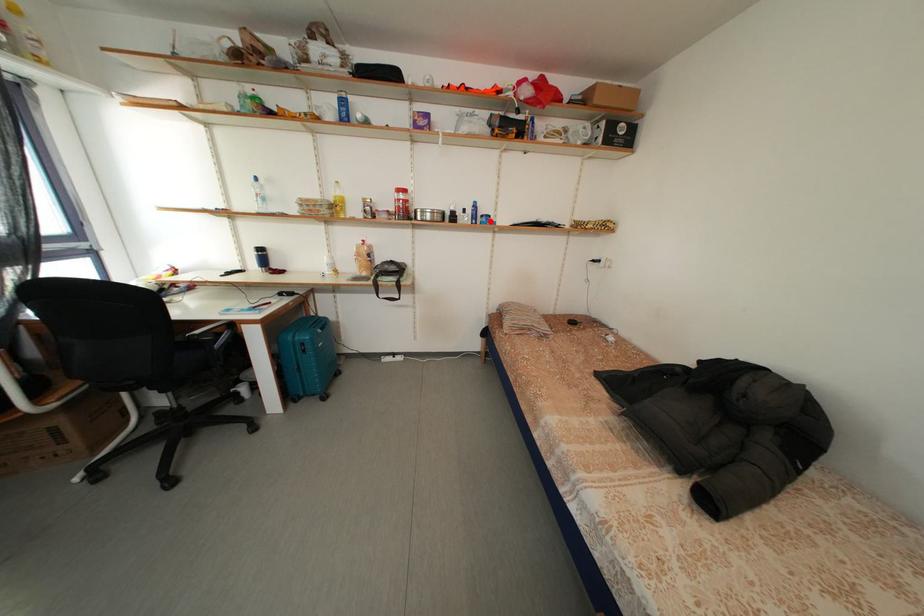
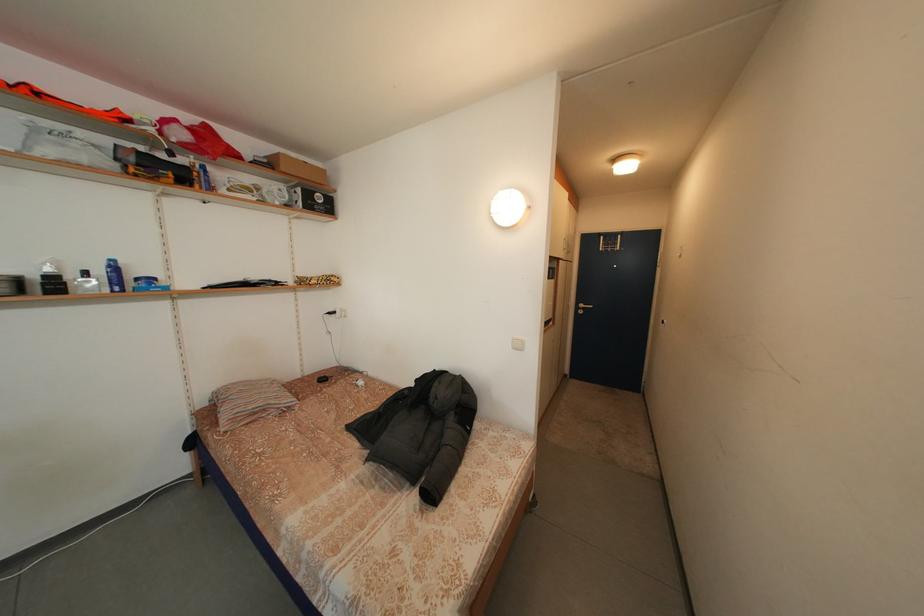
The point at the highlighted location is marked in the first image. Where is the corresponding point in the second image?

(146, 285)